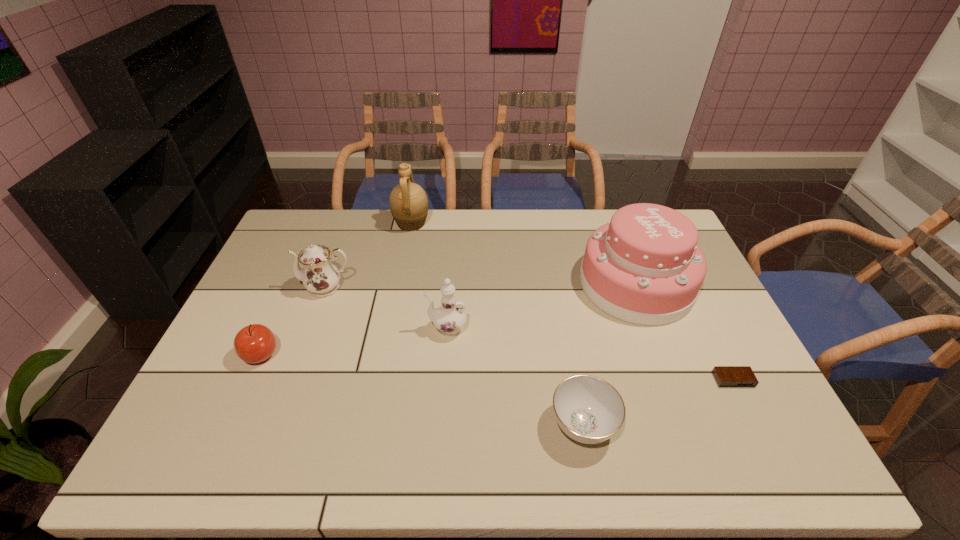
I want to click on vacant area between the nearest chinaware and the farthest object, so click(497, 325).

This screenshot has width=960, height=540. I want to click on free spot between the leftmost chinaware and the shortest chinaware, so click(x=455, y=356).

Image resolution: width=960 pixels, height=540 pixels. Find the location of `unoccupied position between the second chinaware from left to right and the fifth tallest object`. unoccupied position between the second chinaware from left to right and the fifth tallest object is located at coordinates (353, 341).

This screenshot has height=540, width=960. Find the location of `vacant region between the second farthest chinaware and the shortest object`. vacant region between the second farthest chinaware and the shortest object is located at coordinates (589, 354).

Locate an element on the screen. This screenshot has width=960, height=540. object that stands as the second closest to the second chinaware from left to right is located at coordinates (588, 409).

Choose which object is the fourth nearest neighbor to the nearest object. Please provide its 2D coordinates. Your answer should be formatted as a tuple, i.e. [(x, y)], where the tuple contains the x and y coordinates of a point satisfying the conditions above.

[(319, 276)]

In order to click on the second closest chinaware to the fourth object from right to left in this screenshot , I will do `click(588, 409)`.

Locate an element on the screen. The image size is (960, 540). chinaware that is the second nearest to the alarm clock is located at coordinates (450, 316).

Identify the location of vacant area that satisfies the following two spatial constraints: 1. at the spout of the second farthest chinaware; 2. on the front side of the apple. (444, 354).

This screenshot has width=960, height=540. Find the location of `free region that satisfies the following two spatial constraints: 1. at the spout of the nearest object; 2. on the left side of the fourth object from left to right`. free region that satisfies the following two spatial constraints: 1. at the spout of the nearest object; 2. on the left side of the fourth object from left to right is located at coordinates (439, 425).